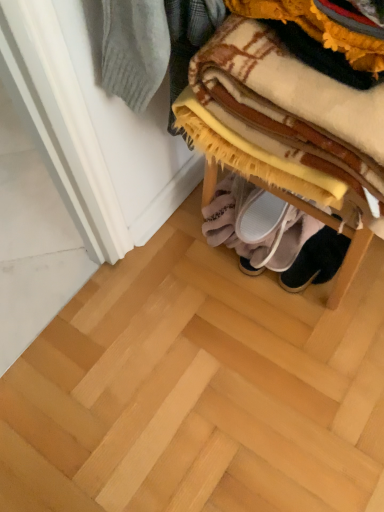
This screenshot has height=512, width=384. I want to click on blank space situated above black suede shoes at lower center, placed as the second footwear when sorted from left to right (from a real-world perspective), so click(314, 247).